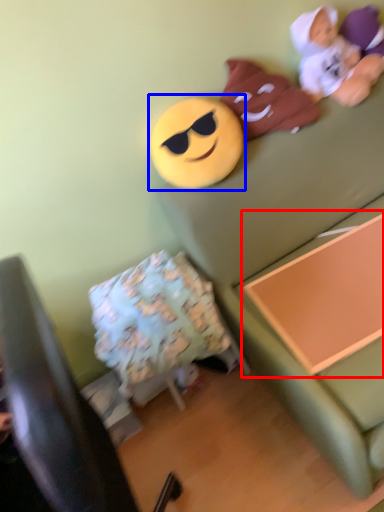
Question: Among these objects, which one is farthest to the camera, changing table (highlighted by a red box) or toy (highlighted by a blue box)?

Choices:
 (A) changing table
 (B) toy

Answer: (B)